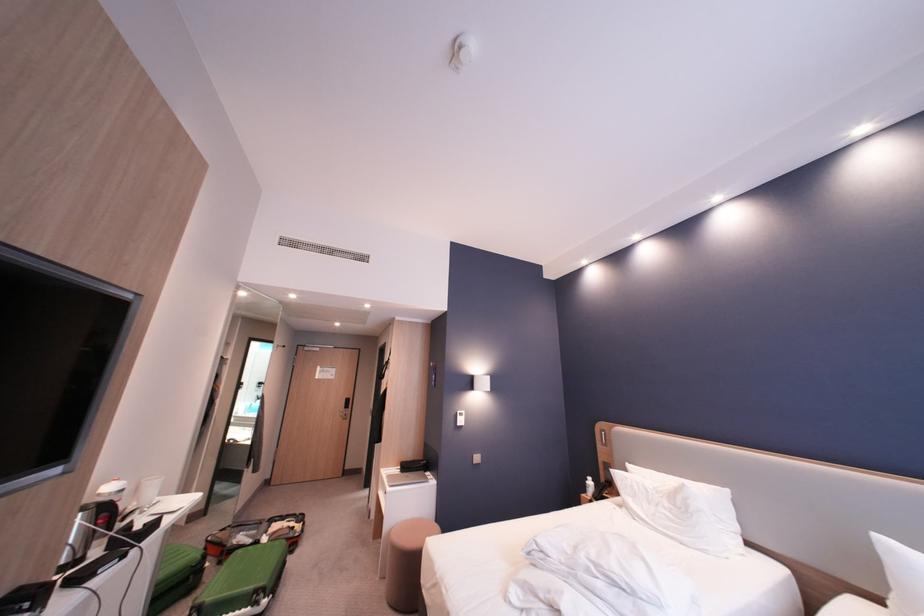
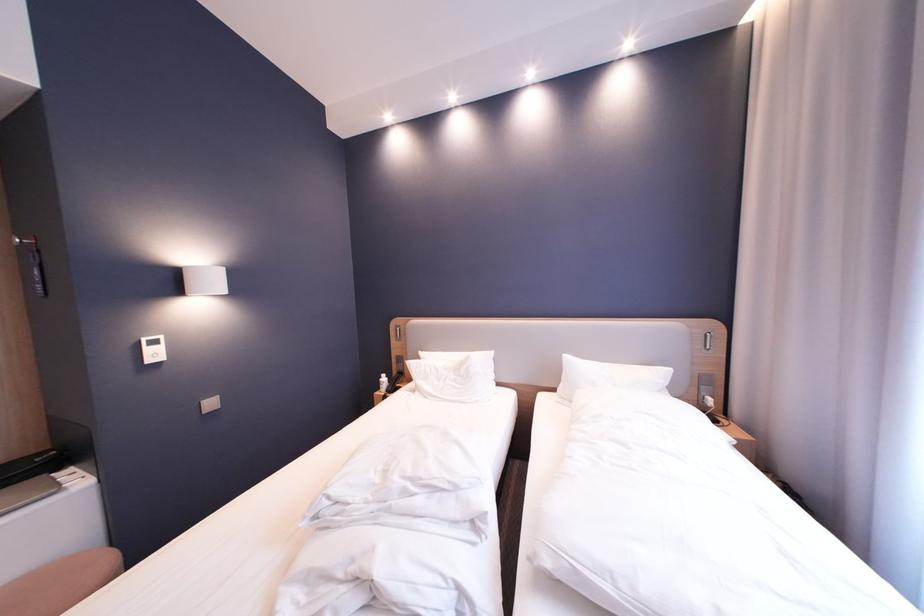
The first image is from the beginning of the video and the second image is from the end. How did the camera likely rotate when shooting the video?

The rotation direction of the camera is right-down.